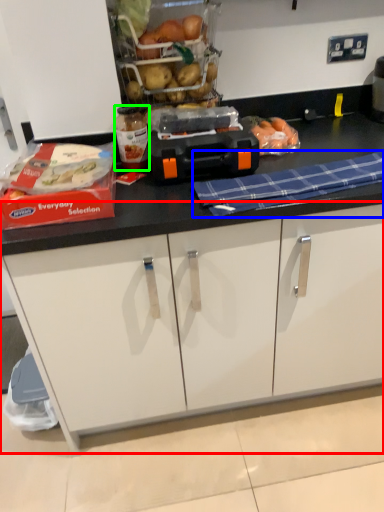
Question: Which object is positioned closest to cabinetry (highlighted by a red box)? Select from blanket (highlighted by a blue box) and bottle (highlighted by a green box).

Choices:
 (A) blanket
 (B) bottle

Answer: (A)